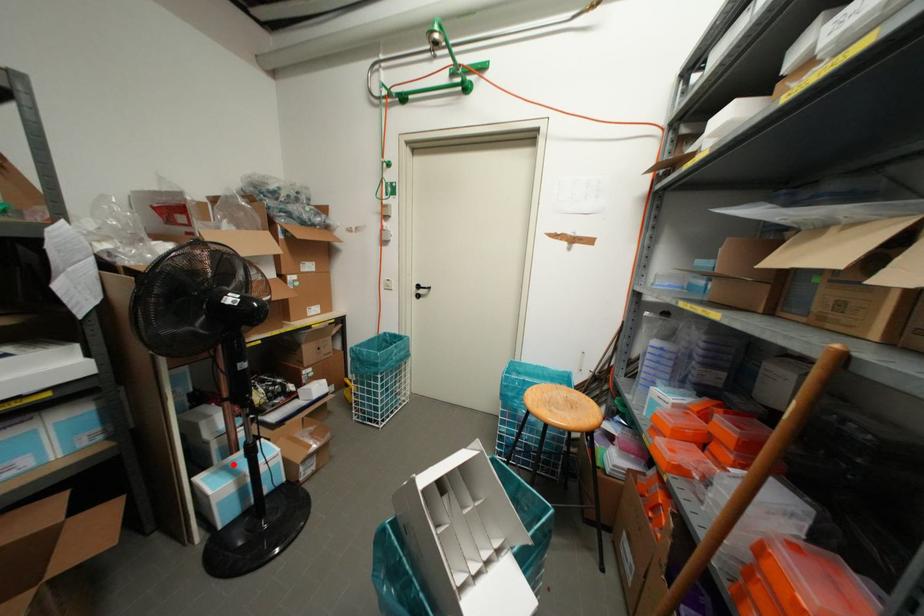
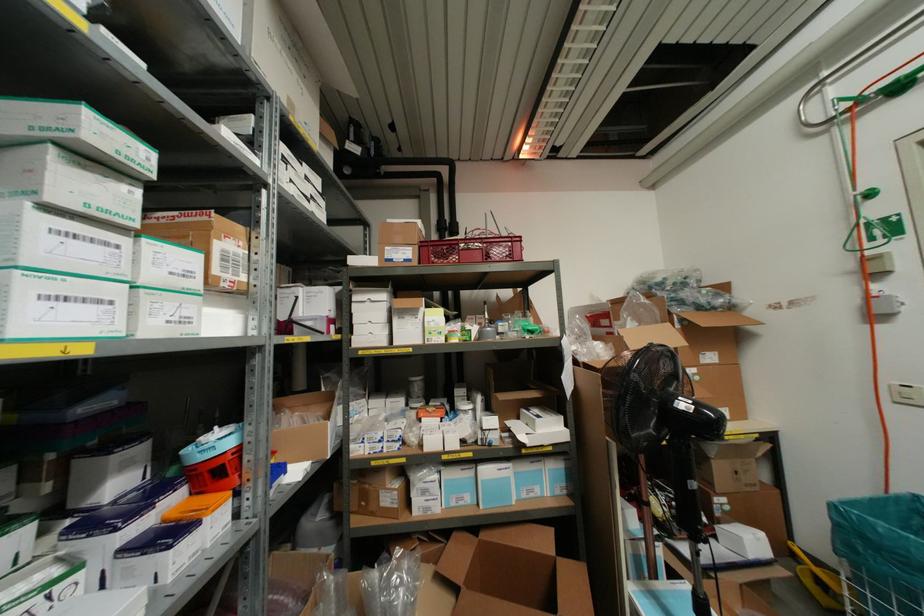
Question: I am providing you with two images of the same scene from different viewpoints. Image1 has a red point marked. In image2, the corresponding 3D location appears at what relative position? Reply with the corresponding letter.

Choices:
 (A) Closer
 (B) Farther

Answer: (A)